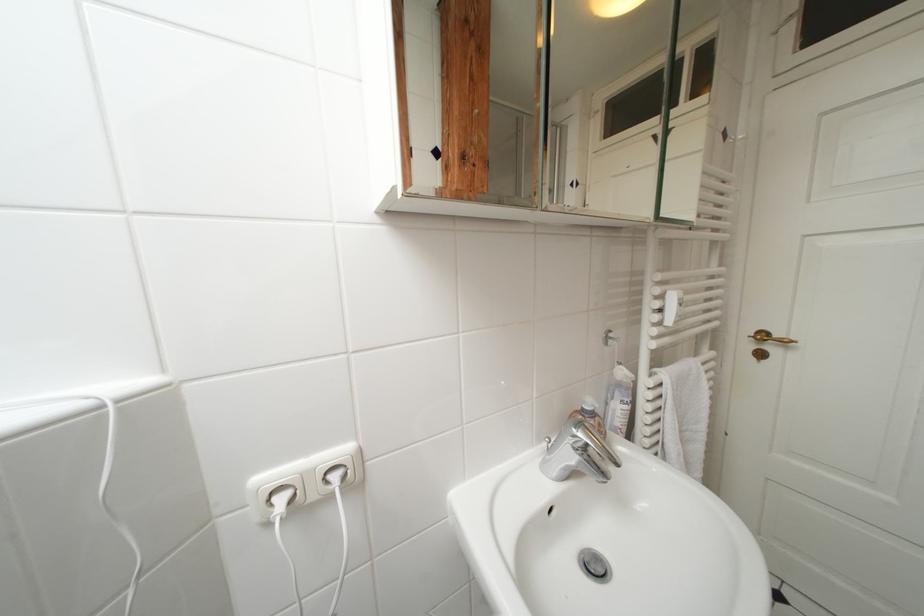
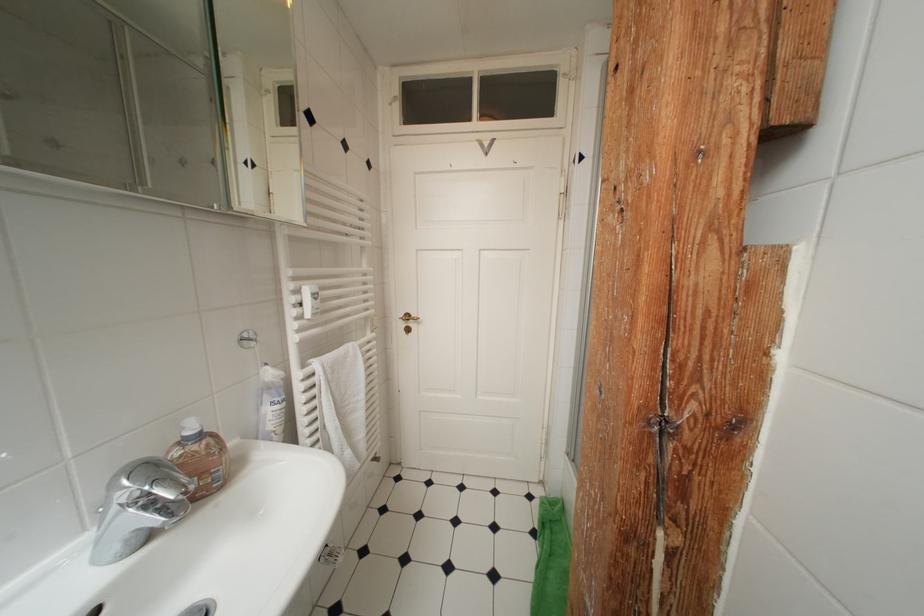
Where in the second image is the point corresponding to (769,339) from the first image?

(415, 320)